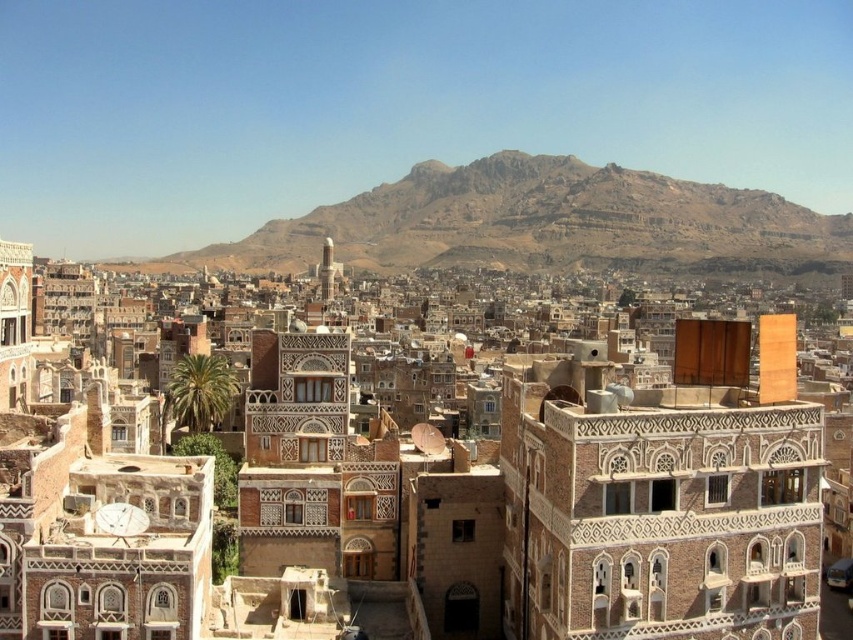
Question: Does brown textured building at center appear on the right side of rugged brown rock formation at center?

Choices:
 (A) no
 (B) yes

Answer: (A)

Question: Is brown textured building at center positioned before rugged brown rock formation at center?

Choices:
 (A) yes
 (B) no

Answer: (A)

Question: Can you confirm if brown textured building at center is smaller than rugged brown rock formation at center?

Choices:
 (A) no
 (B) yes

Answer: (B)